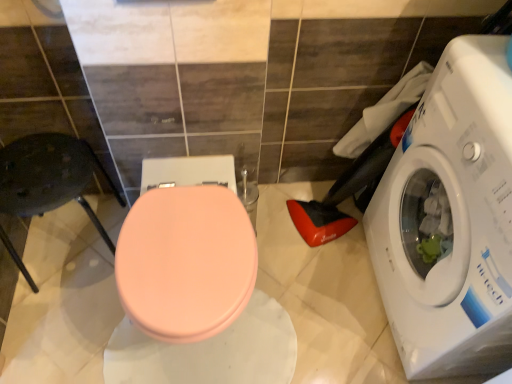
Image resolution: width=512 pixels, height=384 pixels. Identify the location of vacant area that lies in front of metallic dark gray chair at left. (52, 332).